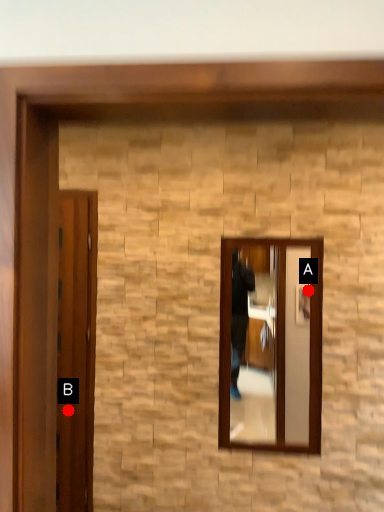
Question: Two points are circled on the image, labeled by A and B beside each circle. Which point is closer to the camera taking this photo?

Choices:
 (A) A is closer
 (B) B is closer

Answer: (A)